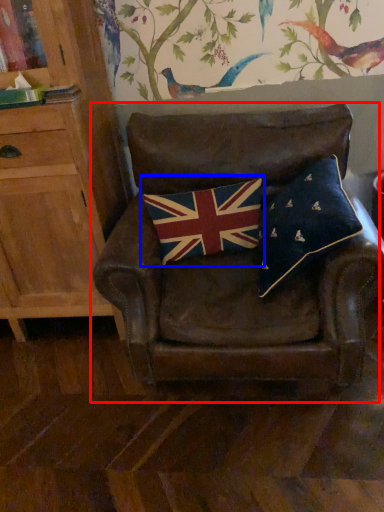
Question: Which of the following is the farthest to the observer, chair (highlighted by a red box) or flag (highlighted by a blue box)?

Choices:
 (A) chair
 (B) flag

Answer: (B)